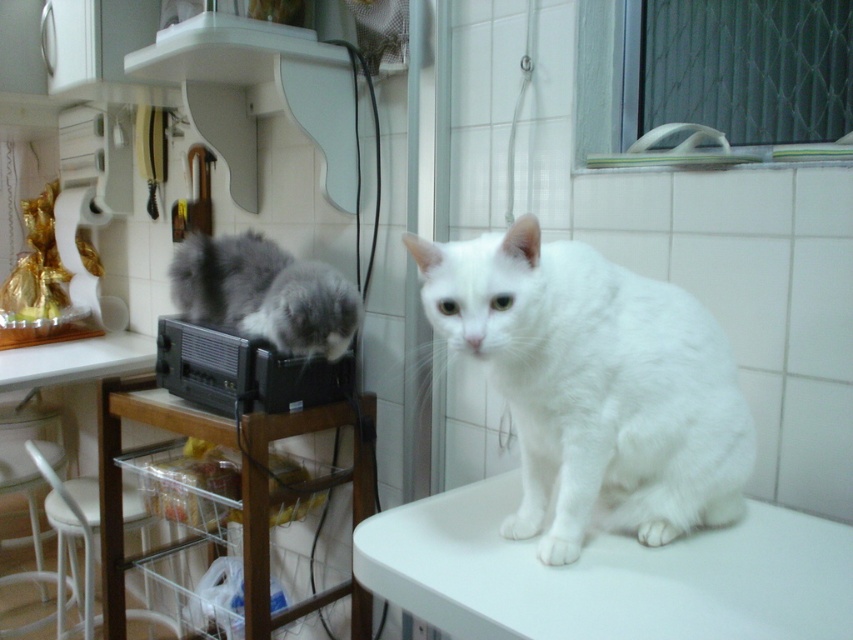
Question: Which of the following is the closest to the observer?

Choices:
 (A) (659, 317)
 (B) (16, 353)
 (C) (361, 448)
 (D) (283, 250)

Answer: (A)

Question: Can you confirm if white fluffy cat at center is positioned to the left of transparent plastic table at lower left?

Choices:
 (A) yes
 (B) no

Answer: (B)

Question: Is white fluffy cat at center to the left of white plastic table at lower left from the viewer's perspective?

Choices:
 (A) no
 (B) yes

Answer: (A)

Question: Can you confirm if white smooth table at center is positioned below transparent plastic table at lower left?

Choices:
 (A) yes
 (B) no

Answer: (B)

Question: Considering the real-world distances, which object is closest to the white plastic table at lower left?

Choices:
 (A) white fluffy cat at center
 (B) white smooth table at center
 (C) fluffy gray cat at left
 (D) transparent plastic table at lower left

Answer: (D)

Question: Which object is the farthest from the fluffy gray cat at left?

Choices:
 (A) transparent plastic table at lower left
 (B) white fluffy cat at center
 (C) white smooth table at center
 (D) white plastic table at lower left

Answer: (C)